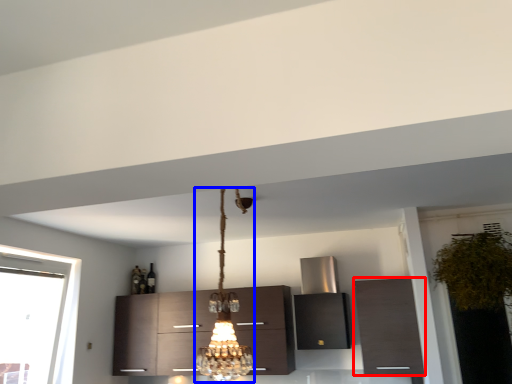
Question: Which object appears farthest to the camera in this image, cabinetry (highlighted by a red box) or lamp (highlighted by a blue box)?

Choices:
 (A) cabinetry
 (B) lamp

Answer: (A)